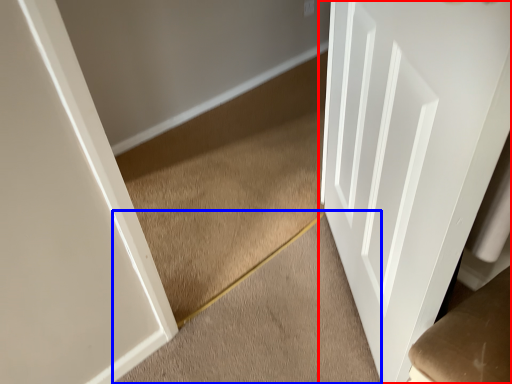
Question: Which object appears farthest to the camera in this image, door (highlighted by a red box) or stairwell (highlighted by a blue box)?

Choices:
 (A) door
 (B) stairwell

Answer: (B)